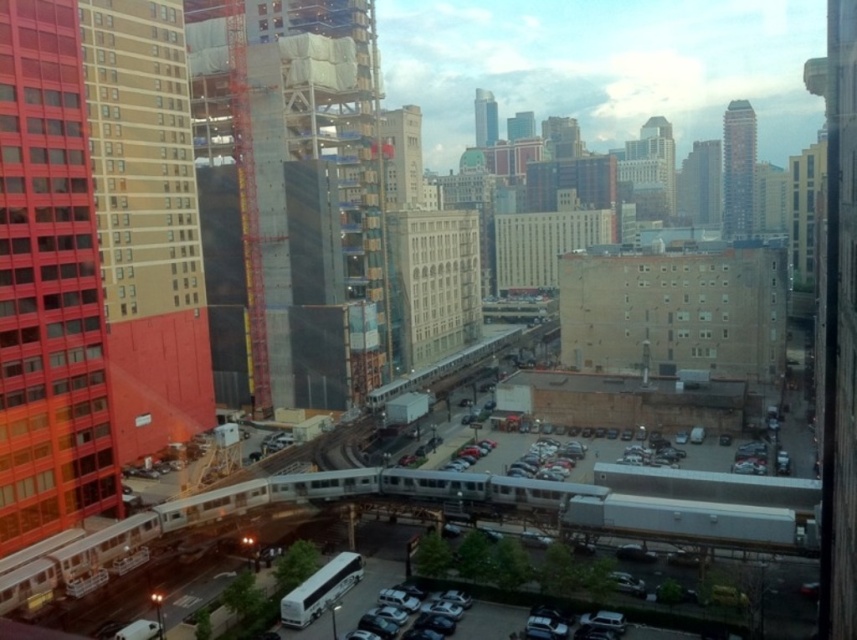
You are standing at the train station and notice the smooth glass windows at left and the metallic silver car at lower center. Which object is located more to the left side?

The smooth glass windows at left is positioned on the left side of metallic silver car at lower center, so it is more to the left.

You are standing at the train station and want to take a photo of the smooth glass windows at left. If your camera can focus on objects up to 60 meters away, will you be able to capture a clear image?

The smooth glass windows at left is 62.36 meters away from viewer, which is beyond the camera focus limit of 60 meters. Therefore, the camera cannot capture a clear image of the smooth glass windows at left.